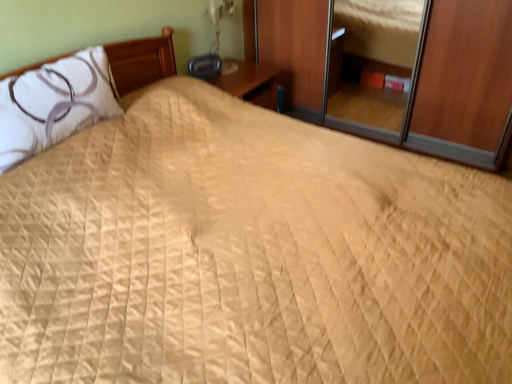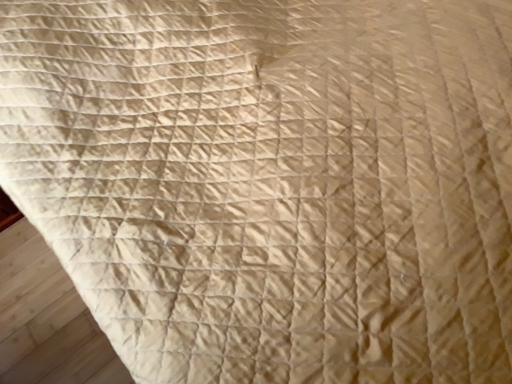
Question: How did the camera likely rotate when shooting the video?

Choices:
 (A) rotated right
 (B) rotated left

Answer: (B)